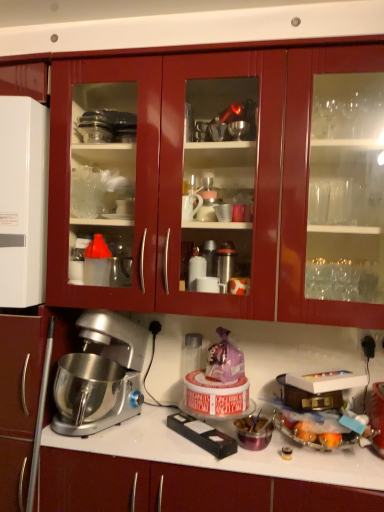
The width and height of the screenshot is (384, 512). What do you see at coordinates (23, 201) in the screenshot?
I see `white glossy refrigerator at left, which appears as the 1th appliance when viewed from the left` at bounding box center [23, 201].

How much space does white glossy refrigerator at left, which is the 2th appliance from bottom to top, occupy horizontally?

It is 40.68 centimeters.

Describe the element at coordinates (100, 375) in the screenshot. I see `silver metallic mixer at lower left` at that location.

Image resolution: width=384 pixels, height=512 pixels. What do you see at coordinates (370, 342) in the screenshot?
I see `black plastic electrical outlet at upper right` at bounding box center [370, 342].

This screenshot has height=512, width=384. Identify the location of white glossy refrigerator at left, which is the 2th appliance in right-to-left order. click(x=23, y=201).

Which is in front, point (85, 404) or point (182, 233)?

The point (85, 404) is in front.

Based on the photo, does silver metallic mixer at lower left turn towards glossy wood cabinets at upper center?

No, silver metallic mixer at lower left is not facing towards glossy wood cabinets at upper center.

From the picture: From the image's perspective, which is above, silver metallic mixer at lower left or glossy wood cabinets at upper center?

glossy wood cabinets at upper center is shown above in the image.

From a real-world perspective, is silver metallic mixer at lower left located higher than glossy wood cabinets at upper center?

No, from a real-world perspective, silver metallic mixer at lower left is not above glossy wood cabinets at upper center.

Would you say satin silver countertop at center is to the left or to the right of glossy wood cabinets at upper center in the picture?

Clearly, satin silver countertop at center is on the left of glossy wood cabinets at upper center in the image.

Between satin silver countertop at center and glossy wood cabinets at upper center, which one has smaller width?

With smaller width is glossy wood cabinets at upper center.

In terms of height, does satin silver countertop at center look taller or shorter compared to glossy wood cabinets at upper center?

In the image, satin silver countertop at center appears to be shorter than glossy wood cabinets at upper center.

Consider the image. Considering the positions of objects satin silver countertop at center and glossy wood cabinets at upper center in the image provided, who is behind, satin silver countertop at center or glossy wood cabinets at upper center?

glossy wood cabinets at upper center is further from the camera.

Is there a large distance between translucent plastic container at lower right, positioned as the second appliance in left-to-right order, and satin silver countertop at center?

translucent plastic container at lower right, positioned as the second appliance in left-to-right order, is near satin silver countertop at center, not far away.

Is translucent plastic container at lower right, the second appliance in the top-to-bottom sequence, completely or partially outside of satin silver countertop at center?

Absolutely, translucent plastic container at lower right, the second appliance in the top-to-bottom sequence, is external to satin silver countertop at center.

Is point (274, 394) in front of point (158, 456)?

No, it is behind (158, 456).

Is translucent plastic container at lower right, the 1th appliance positioned from the bottom, positioned with its back to satin silver countertop at center?

No, satin silver countertop at center is not at the back of translucent plastic container at lower right, the 1th appliance positioned from the bottom.

From the image's perspective, which one is positioned lower, satin silver countertop at center or silver metallic mixer at lower left?

satin silver countertop at center is shown below in the image.

Based on the photo, does satin silver countertop at center have a larger size compared to silver metallic mixer at lower left?

Yes, satin silver countertop at center is bigger than silver metallic mixer at lower left.

Considering the sizes of satin silver countertop at center and silver metallic mixer at lower left in the image, is satin silver countertop at center wider or thinner than silver metallic mixer at lower left?

Clearly, satin silver countertop at center has less width compared to silver metallic mixer at lower left.

Considering the relative positions of satin silver countertop at center and silver metallic mixer at lower left in the image provided, is satin silver countertop at center to the right of silver metallic mixer at lower left from the viewer's perspective?

Yes, satin silver countertop at center is to the right of silver metallic mixer at lower left.

Is glossy wood cabinets at upper center positioned far away from translucent plastic container at lower right, positioned as the second appliance in left-to-right order?

glossy wood cabinets at upper center is near translucent plastic container at lower right, positioned as the second appliance in left-to-right order, not far away.

Looking at their sizes, would you say glossy wood cabinets at upper center is wider or thinner than translucent plastic container at lower right, the first appliance in the right-to-left sequence?

Clearly, glossy wood cabinets at upper center has more width compared to translucent plastic container at lower right, the first appliance in the right-to-left sequence.

From a real-world perspective, which object rests below the other?

translucent plastic container at lower right, the 1th appliance positioned from the bottom.

Does silver metallic mixer at lower left have a lesser width compared to white glossy refrigerator at left, which appears as the 1th appliance when viewed from the left?

No.

Considering the sizes of objects silver metallic mixer at lower left and white glossy refrigerator at left, which is the 2th appliance from bottom to top, in the image provided, who is smaller, silver metallic mixer at lower left or white glossy refrigerator at left, which is the 2th appliance from bottom to top,?

silver metallic mixer at lower left.

Is silver metallic mixer at lower left oriented away from white glossy refrigerator at left, which is the 2th appliance from bottom to top?

silver metallic mixer at lower left does not have its back to white glossy refrigerator at left, which is the 2th appliance from bottom to top.

Considering the positions of objects black plastic electrical outlet at upper right and white glossy refrigerator at left, which appears as the 1th appliance when viewed from the left, in the image provided, who is in front, black plastic electrical outlet at upper right or white glossy refrigerator at left, which appears as the 1th appliance when viewed from the left,?

white glossy refrigerator at left, which appears as the 1th appliance when viewed from the left, is in front.

Would you consider black plastic electrical outlet at upper right to be distant from white glossy refrigerator at left, which is the 2th appliance from bottom to top?

That's right, there is a large distance between black plastic electrical outlet at upper right and white glossy refrigerator at left, which is the 2th appliance from bottom to top.

Does black plastic electrical outlet at upper right have a larger size compared to white glossy refrigerator at left, which appears as the first appliance when viewed from the top?

Actually, black plastic electrical outlet at upper right might be smaller than white glossy refrigerator at left, which appears as the first appliance when viewed from the top.

Locate an element on the screen. mixer below the glossy wood cabinets at upper center (from the image's perspective) is located at coordinates (100, 375).

I want to click on cabinetry above the satin silver countertop at center (from the image's perspective), so click(x=216, y=184).

When comparing their distances from silver metallic mixer at lower left, does black plastic electrical outlet at upper right or white glossy refrigerator at left, which appears as the 1th appliance when viewed from the left, seem further?

black plastic electrical outlet at upper right is further to silver metallic mixer at lower left.

Looking at the image, which one is located further to black plastic electrical outlet at upper right, white glossy refrigerator at left, which is the 2th appliance from bottom to top, or glossy wood cabinets at upper center?

white glossy refrigerator at left, which is the 2th appliance from bottom to top, is further to black plastic electrical outlet at upper right.

When comparing their distances from white glossy refrigerator at left, which appears as the first appliance when viewed from the top, does translucent plastic container at lower right, positioned as the second appliance in left-to-right order, or glossy wood cabinets at upper center seem further?

translucent plastic container at lower right, positioned as the second appliance in left-to-right order, is further to white glossy refrigerator at left, which appears as the first appliance when viewed from the top.

Which object lies further to the anchor point satin silver countertop at center, black plastic electrical outlet at upper right or translucent plastic container at lower right, the 1th appliance positioned from the bottom?

black plastic electrical outlet at upper right.

Which object lies further to the anchor point satin silver countertop at center, translucent plastic container at lower right, the second appliance in the top-to-bottom sequence, or black plastic electrical outlet at upper right?

Among the two, black plastic electrical outlet at upper right is located further to satin silver countertop at center.

Which object lies nearer to the anchor point silver metallic mixer at lower left, translucent plastic container at lower right, the first appliance in the right-to-left sequence, or white glossy refrigerator at left, which appears as the first appliance when viewed from the top?

white glossy refrigerator at left, which appears as the first appliance when viewed from the top.

Based on their spatial positions, is translucent plastic container at lower right, the first appliance in the right-to-left sequence, or satin silver countertop at center further from white glossy refrigerator at left, which appears as the 1th appliance when viewed from the left?

Based on the image, translucent plastic container at lower right, the first appliance in the right-to-left sequence, appears to be further to white glossy refrigerator at left, which appears as the 1th appliance when viewed from the left.

When comparing their distances from satin silver countertop at center, does black plastic electrical outlet at upper right or silver metallic mixer at lower left seem further?

Among the two, black plastic electrical outlet at upper right is located further to satin silver countertop at center.

Identify the location of electric outlet between glossy wood cabinets at upper center and satin silver countertop at center in the up-down direction. This screenshot has width=384, height=512. (370, 342).

Where is `cabinetry between white glossy refrigerator at left, which appears as the 1th appliance when viewed from the left, and translucent plastic container at lower right, the first appliance in the right-to-left sequence, in the horizontal direction`? This screenshot has height=512, width=384. cabinetry between white glossy refrigerator at left, which appears as the 1th appliance when viewed from the left, and translucent plastic container at lower right, the first appliance in the right-to-left sequence, in the horizontal direction is located at coordinates (216, 184).

Where is `cabinetry between silver metallic mixer at lower left and black plastic electrical outlet at upper right`? This screenshot has height=512, width=384. cabinetry between silver metallic mixer at lower left and black plastic electrical outlet at upper right is located at coordinates (216, 184).

I want to click on mixer between white glossy refrigerator at left, which is the 2th appliance in right-to-left order, and satin silver countertop at center from top to bottom, so click(100, 375).